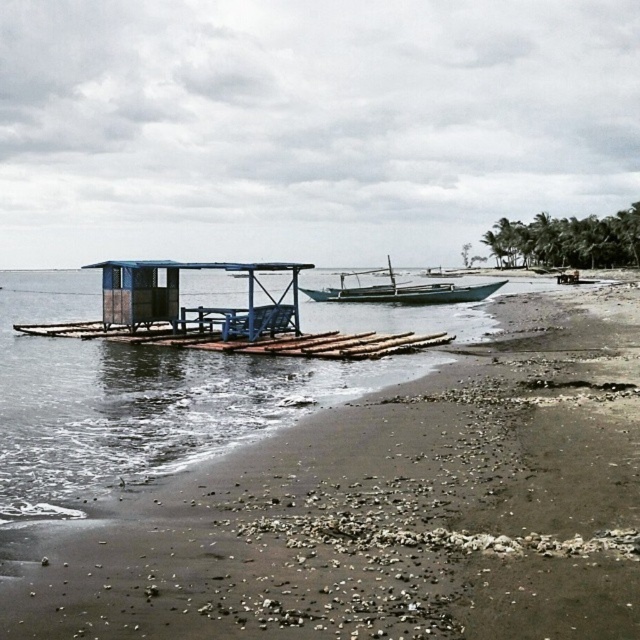
You are a tourist standing on the brown sandy beach at lower left and want to reach the wooden boat at center. The path is clear, but you have a 20 meter rope to secure your belongings. Is the rope long enough to tow your items to the boat?

The distance between the brown sandy beach at lower left and the wooden boat at center is 30.71 meters. Since the rope is only 20 meters long, it is not long enough to tow your items to the boat.

You are standing on the brown sandy beach at lower left and want to reach the wooden boat at center. According to the scene, which direction should you move towards?

The brown sandy beach at lower left is positioned under the wooden boat at center, so you should move upwards to reach the wooden boat at center.

Consider the image. You are standing on the brown sandy beach at lower left and want to reach the wooden boat at center. Since the beach is narrower than the boat, can you walk around the boat without stepping into the water?

The brown sandy beach at lower left is narrower than the wooden boat at center, so you cannot walk around the boat without stepping into the water because the beach is not wide enough.